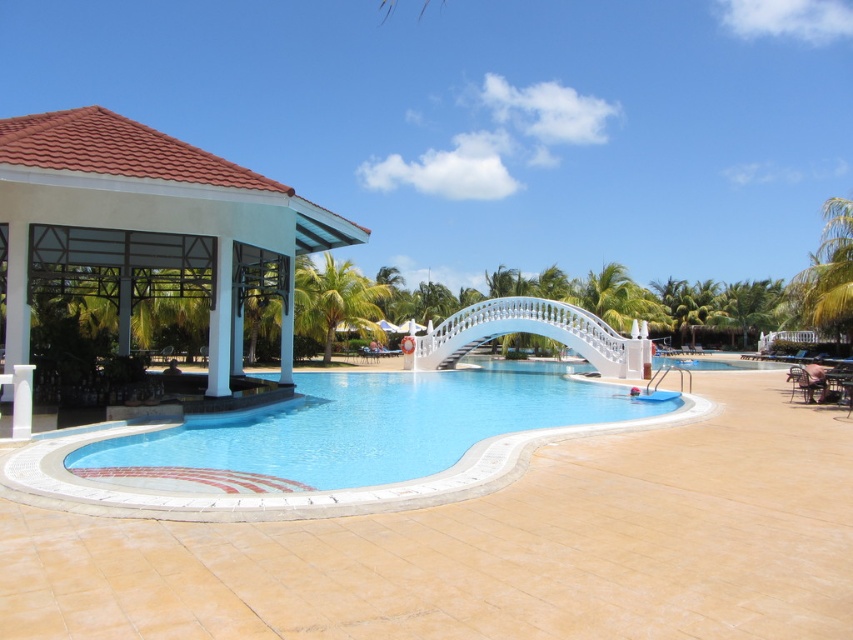
Question: Which point is closer to the camera taking this photo?

Choices:
 (A) (316, 396)
 (B) (821, 296)
 (C) (221, 304)
 (D) (369, 282)

Answer: (C)

Question: Which of the following is the closest to the observer?

Choices:
 (A) (73, 152)
 (B) (838, 241)

Answer: (A)

Question: Observing the image, what is the correct spatial positioning of green leafy palm tree at center in reference to green leafy palm tree at right?

Choices:
 (A) left
 (B) right

Answer: (A)

Question: From the image, what is the correct spatial relationship of white matte gazebo at left in relation to green leafy palm tree at right?

Choices:
 (A) left
 (B) right

Answer: (A)

Question: Which of the following is the farthest from the observer?

Choices:
 (A) blue glossy pool at center
 (B) green leafy palm tree at center
 (C) white matte gazebo at left

Answer: (B)

Question: Is blue glossy pool at center to the right of green leafy palm tree at center from the viewer's perspective?

Choices:
 (A) yes
 (B) no

Answer: (A)